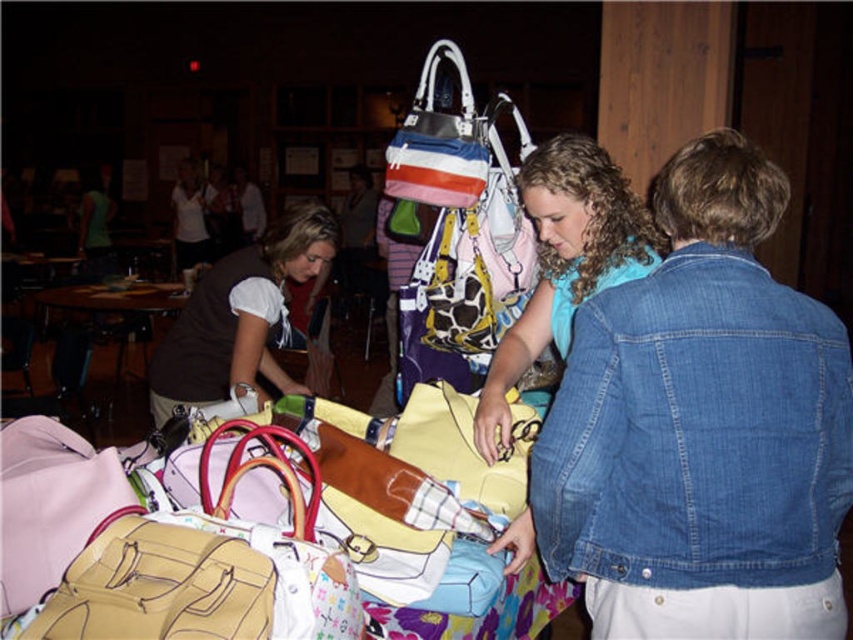
Question: Does matte yellow purse at center lie behind wooden round table at center?

Choices:
 (A) no
 (B) yes

Answer: (A)

Question: Which point is closer to the camera taking this photo?

Choices:
 (A) (308, 243)
 (B) (692, 301)
 (C) (97, 296)
 (D) (389, 179)

Answer: (B)

Question: Among these points, which one is nearest to the camera?

Choices:
 (A) (599, 236)
 (B) (45, 317)

Answer: (A)

Question: Which point is closer to the camera taking this photo?

Choices:
 (A) (57, 305)
 (B) (434, 170)
 (C) (532, 208)
 (D) (618, 403)

Answer: (D)

Question: Can you confirm if striped canvas tote at center is positioned above wooden round table at center?

Choices:
 (A) yes
 (B) no

Answer: (A)

Question: Is denim jacket at lower right wider than wooden round table at center?

Choices:
 (A) yes
 (B) no

Answer: (B)